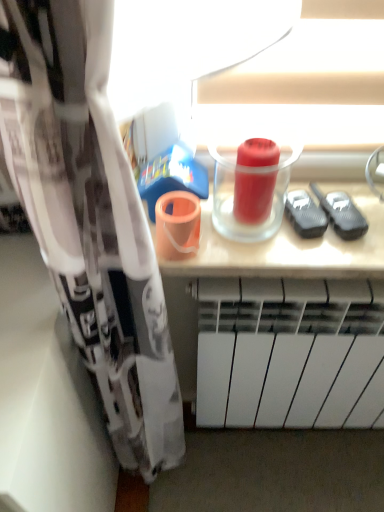
What are the coordinates of `free location in front of red matte cup at center` in the screenshot? It's located at (255, 254).